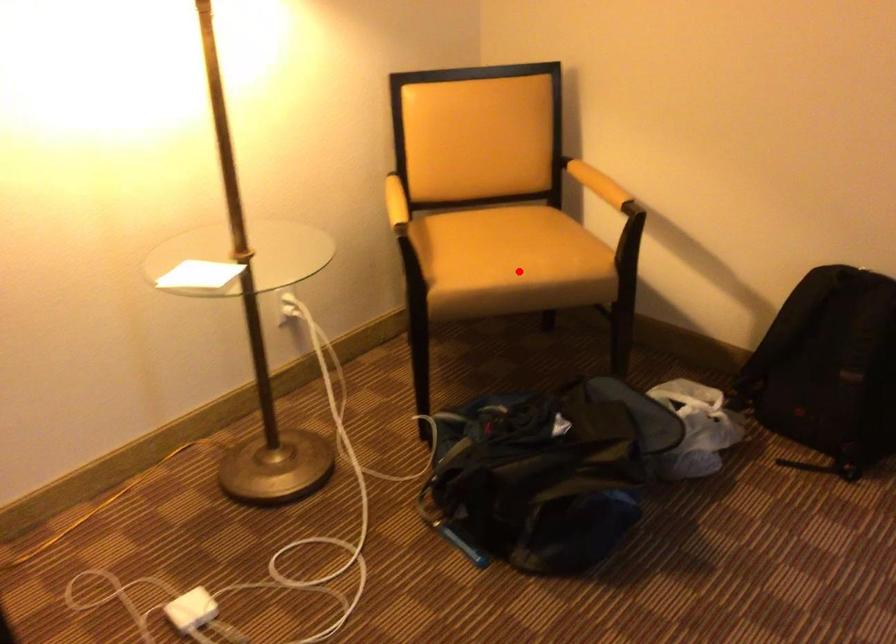
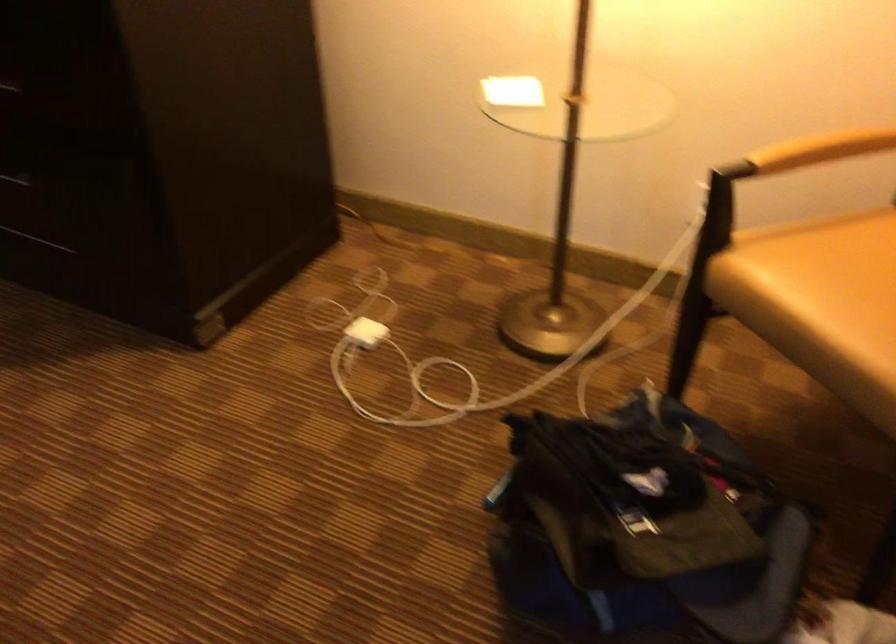
Question: I am providing you with two images of the same scene from different viewpoints. In image1, a red point is highlighted. Considering the same 3D point in image2, which of the following is correct?

Choices:
 (A) It is closer
 (B) It is farther

Answer: (A)